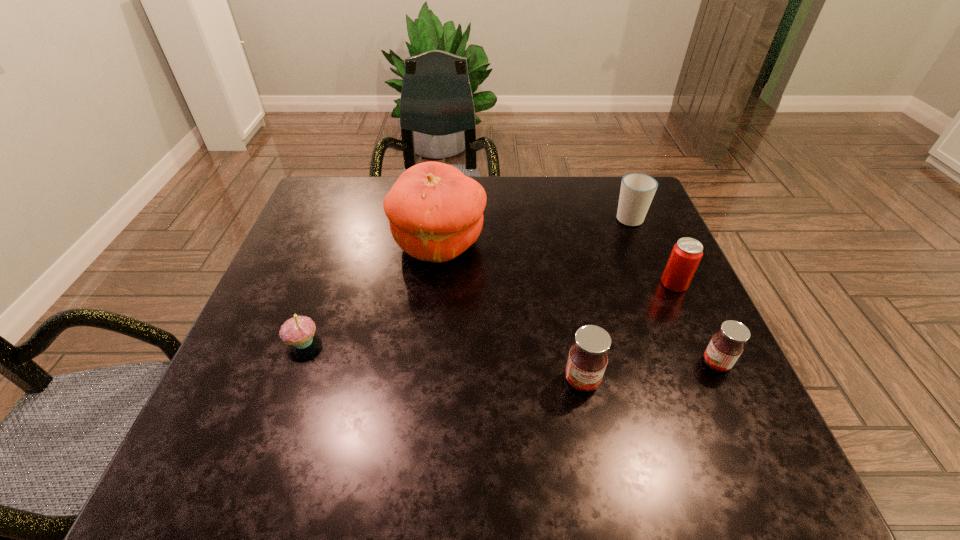
The height and width of the screenshot is (540, 960). What are the coordinates of `the taller jam` in the screenshot? It's located at (587, 360).

Locate an element on the screen. The width and height of the screenshot is (960, 540). the left jam is located at coordinates (587, 360).

Find the location of a particular element. the right jam is located at coordinates (726, 346).

Locate an element on the screen. This screenshot has height=540, width=960. cup is located at coordinates (637, 190).

Image resolution: width=960 pixels, height=540 pixels. I want to click on the fifth object from right to left, so click(x=435, y=212).

The height and width of the screenshot is (540, 960). What are the coordinates of `pumpkin` in the screenshot? It's located at (435, 212).

Locate an element on the screen. Image resolution: width=960 pixels, height=540 pixels. the leftmost object is located at coordinates (298, 331).

What are the coordinates of `can` in the screenshot? It's located at (686, 254).

Where is `free location located on the label side of the right jam`? free location located on the label side of the right jam is located at coordinates coord(588,363).

Where is `vacant space situated 0.130m on the label side of the right jam`? The height and width of the screenshot is (540, 960). vacant space situated 0.130m on the label side of the right jam is located at coordinates [636, 363].